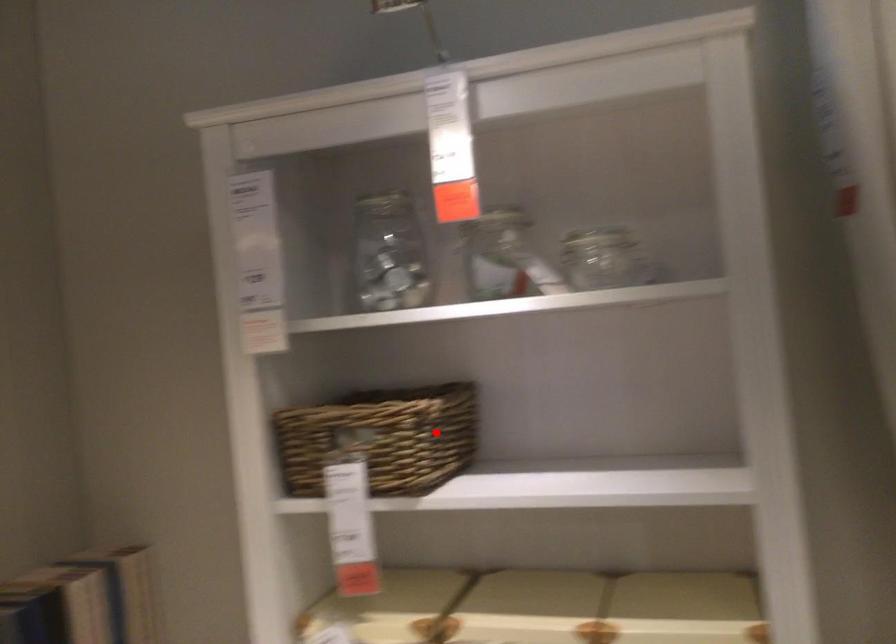
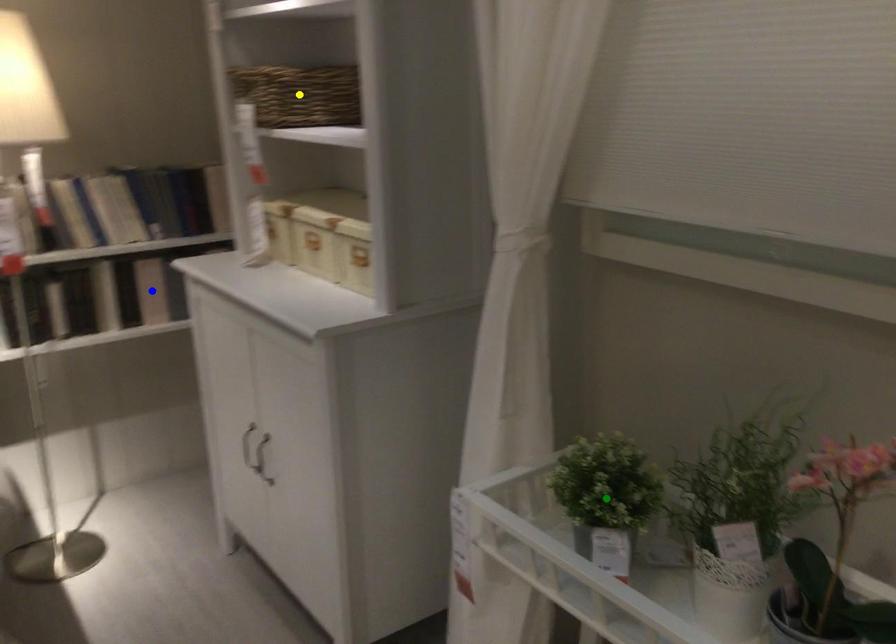
Question: I am providing you with two images of the same scene from different viewpoints. A red point is marked on the first image. You are given multiple points on the second image. Which spot in image 2 lines up with the point in image 1?

Choices:
 (A) blue point
 (B) green point
 (C) yellow point

Answer: (C)